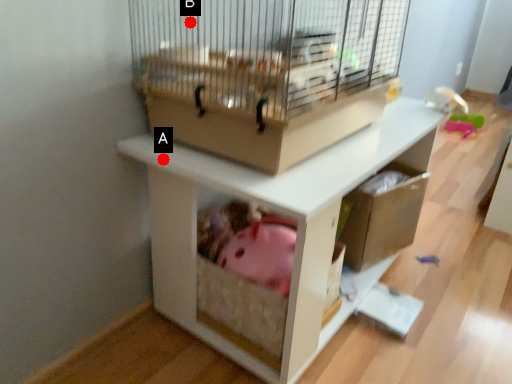
Question: Two points are circled on the image, labeled by A and B beside each circle. Which point is closer to the camera?

Choices:
 (A) A is closer
 (B) B is closer

Answer: (A)